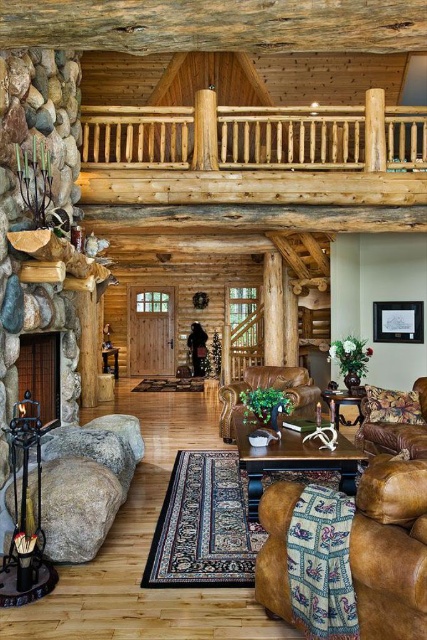
Which of these two, brown leather armchair at lower right or smooth stone fireplace at left, stands shorter?

Standing shorter between the two is brown leather armchair at lower right.

Looking at this image, does brown leather armchair at lower right have a lesser width compared to smooth stone fireplace at left?

No, brown leather armchair at lower right is not thinner than smooth stone fireplace at left.

Between point (256, 560) and point (32, 374), which one is positioned in front?

Positioned in front is point (256, 560).

This screenshot has height=640, width=427. Find the location of `brown leather armchair at lower right`. brown leather armchair at lower right is located at coordinates (391, 550).

Is wooden coffee table at center wider than smooth stone fireplace at left?

Yes, wooden coffee table at center is wider than smooth stone fireplace at left.

In order to click on wooden coffee table at center in this screenshot , I will do `click(292, 460)`.

Is brown leather armchair at lower right above brown leather armchair at center?

Indeed, brown leather armchair at lower right is positioned over brown leather armchair at center.

Is point (278, 524) closer to camera compared to point (309, 380)?

Yes, it is.

Where is `brown leather armchair at lower right`? The width and height of the screenshot is (427, 640). brown leather armchair at lower right is located at coordinates (391, 550).